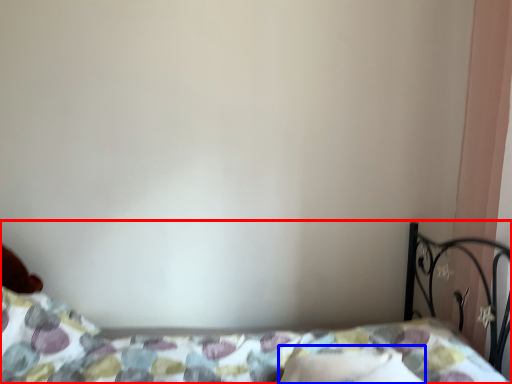
Question: Which point is closer to the camera, bed (highlighted by a red box) or pillow (highlighted by a blue box)?

Choices:
 (A) bed
 (B) pillow

Answer: (A)